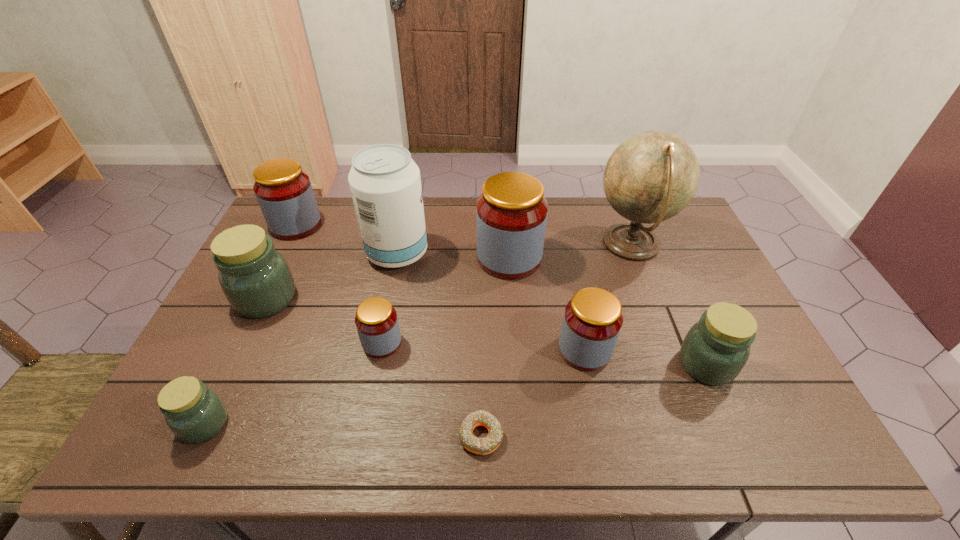
This screenshot has height=540, width=960. In order to click on the fourth jar from left to right in this screenshot , I will do [376, 320].

This screenshot has height=540, width=960. I want to click on the smallest red jar, so click(x=376, y=320).

Locate an element on the screen. the smallest green jar is located at coordinates (194, 413).

The width and height of the screenshot is (960, 540). I want to click on the nearest jar, so click(x=194, y=413).

Identify the location of doughnut. (482, 446).

Where is `the shortest object`? the shortest object is located at coordinates (482, 446).

You are a GUI agent. You are given a task and a screenshot of the screen. Output one action in this format:
    pyautogui.click(x=<x>, y=<y>)
    Task: Click on the free region located on the front-facing side of the globe
    The height and width of the screenshot is (540, 960).
    Given the screenshot: What is the action you would take?
    [x=499, y=245]

Where is `vacant space situated 0.300m on the front-facing side of the globe`? This screenshot has width=960, height=540. vacant space situated 0.300m on the front-facing side of the globe is located at coordinates (502, 245).

The height and width of the screenshot is (540, 960). Find the location of `vacant space located 0.350m on the front-facing side of the globe`. vacant space located 0.350m on the front-facing side of the globe is located at coordinates (488, 245).

Where is `free spot located 0.240m on the left of the alcohol`? The image size is (960, 540). free spot located 0.240m on the left of the alcohol is located at coordinates (294, 254).